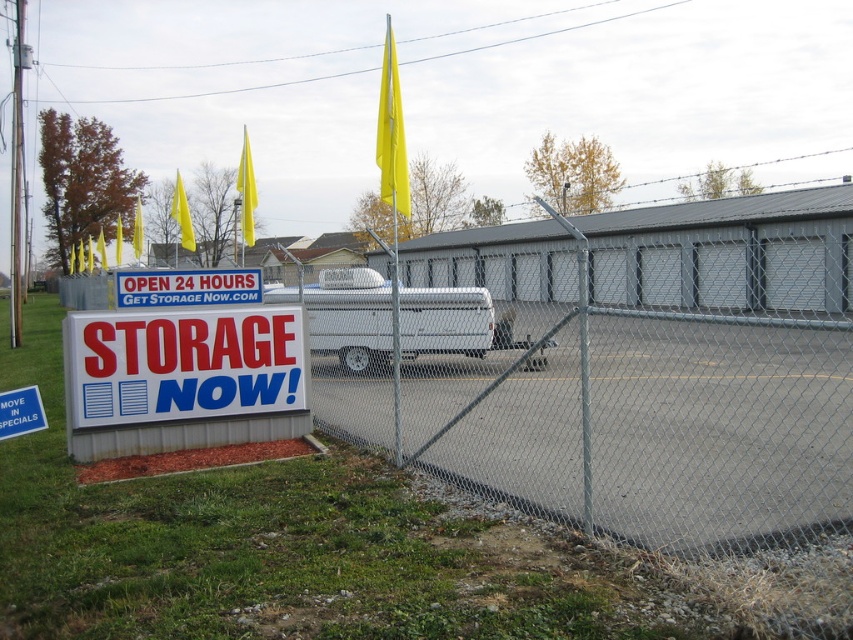
Can you confirm if white plastic sign at lower left is positioned above white plastic sign at center?

No.

Is white plastic sign at lower left positioned before white plastic sign at center?

Yes.

In order to click on white plastic sign at lower left in this screenshot , I will do `click(184, 364)`.

Identify the location of white plastic sign at lower left. (184, 364).

Between gray chain-link fence at center and white matte van at center, which one has more height?

gray chain-link fence at center

Does point (798, 451) come behind point (352, 330)?

That is False.

Where is `gray chain-link fence at center`? This screenshot has width=853, height=640. gray chain-link fence at center is located at coordinates (653, 369).

Which is above, gray chain-link fence at center or white plastic sign at lower left?

gray chain-link fence at center is higher up.

Is point (386, 316) farther from viewer compared to point (102, 320)?

Yes, it is.

The width and height of the screenshot is (853, 640). Identify the location of gray chain-link fence at center. (653, 369).